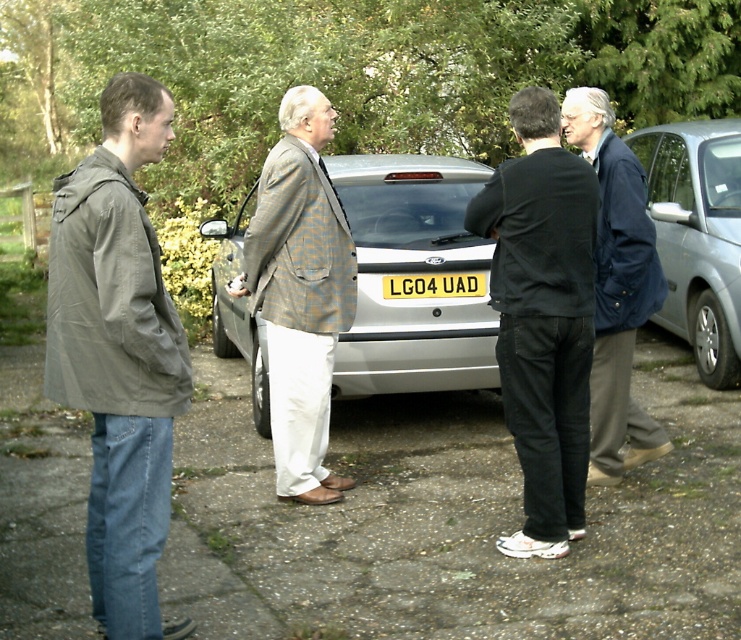
Measure the distance from olive-green fabric jacket at left to blue corduroy jacket at center.

They are 2.87 meters apart.

Is olive-green fabric jacket at left positioned at the back of blue corduroy jacket at center?

No, it is in front of blue corduroy jacket at center.

Does point (130, 177) come behind point (602, 380)?

No, (130, 177) is closer to viewer.

Locate an element on the screen. This screenshot has width=741, height=640. olive-green fabric jacket at left is located at coordinates click(x=119, y=353).

Measure the distance from blue corduroy jacket at center to yellow matte license plate at center.

blue corduroy jacket at center is 1.32 meters from yellow matte license plate at center.

How distant is blue corduroy jacket at center from yellow matte license plate at center?

blue corduroy jacket at center and yellow matte license plate at center are 4.33 feet apart from each other.

What are the coordinates of `blue corduroy jacket at center` in the screenshot? It's located at (617, 288).

In the scene shown: Can you confirm if silver metallic car at center is taller than silver metallic car at right?

No.

Is point (408, 212) closer to viewer compared to point (702, 380)?

Yes, point (408, 212) is in front of point (702, 380).

You are a GUI agent. You are given a task and a screenshot of the screen. Output one action in this format:
    pyautogui.click(x=<x>, y=<y>)
    Task: Click on the silver metallic car at center
    This screenshot has height=640, width=741.
    Given the screenshot: What is the action you would take?
    pyautogui.click(x=412, y=273)